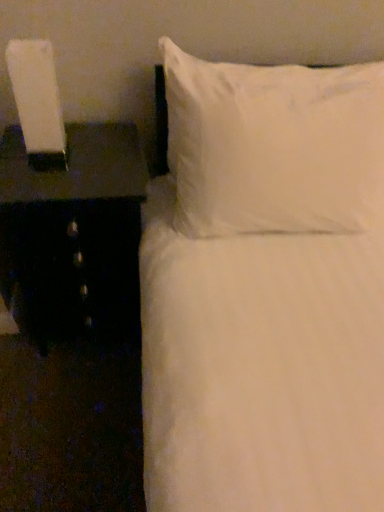
You are a GUI agent. You are given a task and a screenshot of the screen. Output one action in this format:
    pyautogui.click(x=<x>, y=<y>)
    Task: Click on the blank space situated above black glossy nightstand at left (from a real-world perspective)
    This screenshot has height=512, width=384.
    Given the screenshot: What is the action you would take?
    pyautogui.click(x=66, y=165)